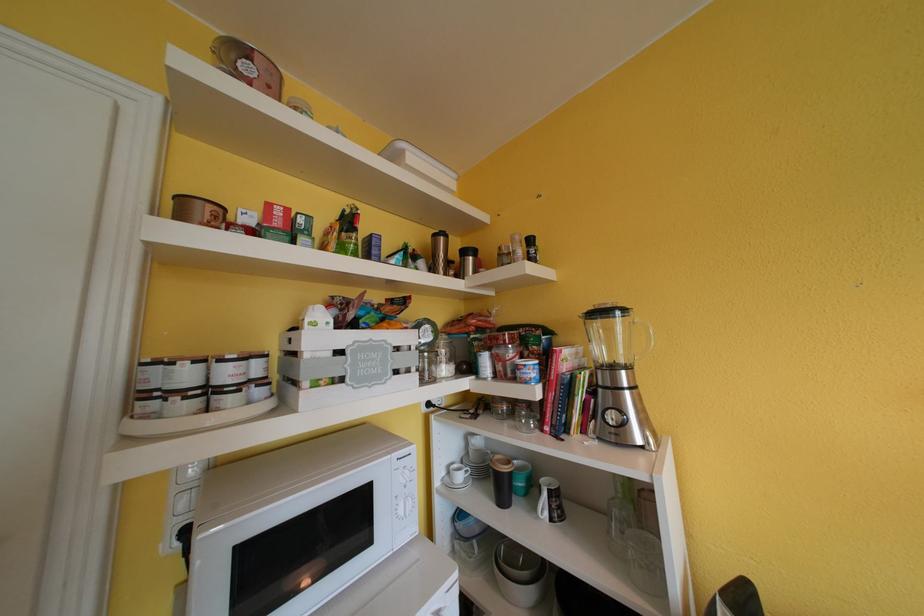
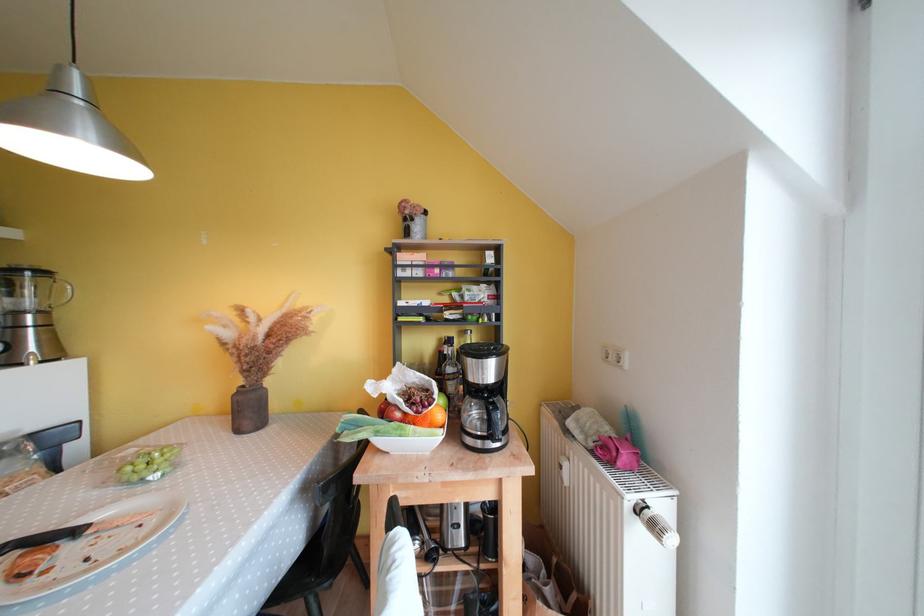
Locate, in the second image, the point that corresponds to pixel 636 371 in the first image.

(49, 315)